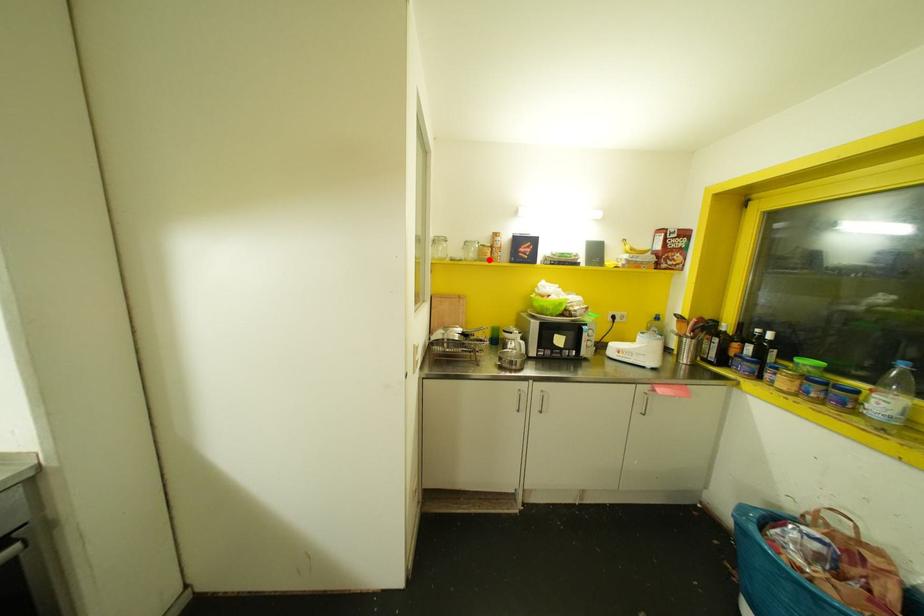
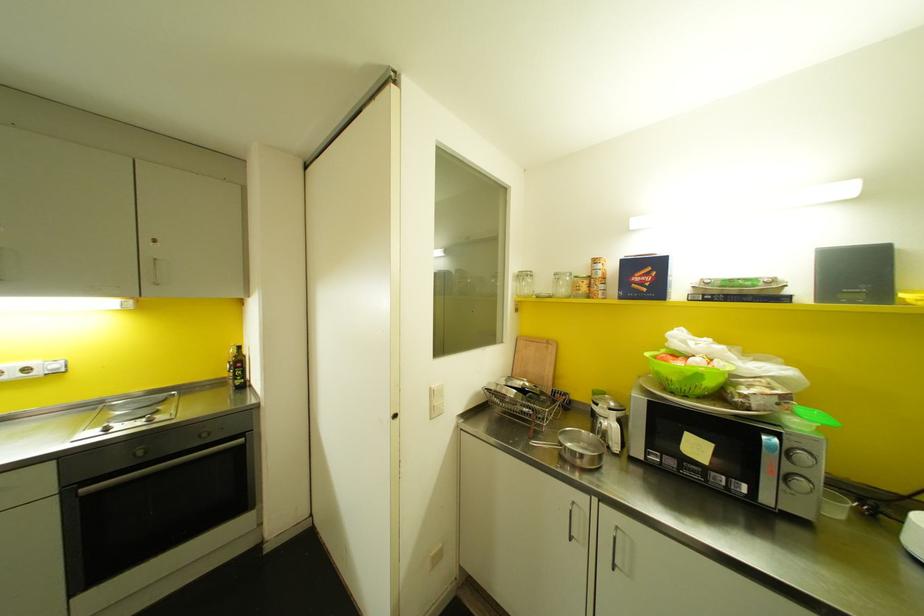
Locate, in the second image, the point that corresponds to the highlighted location in the first image.

(588, 294)